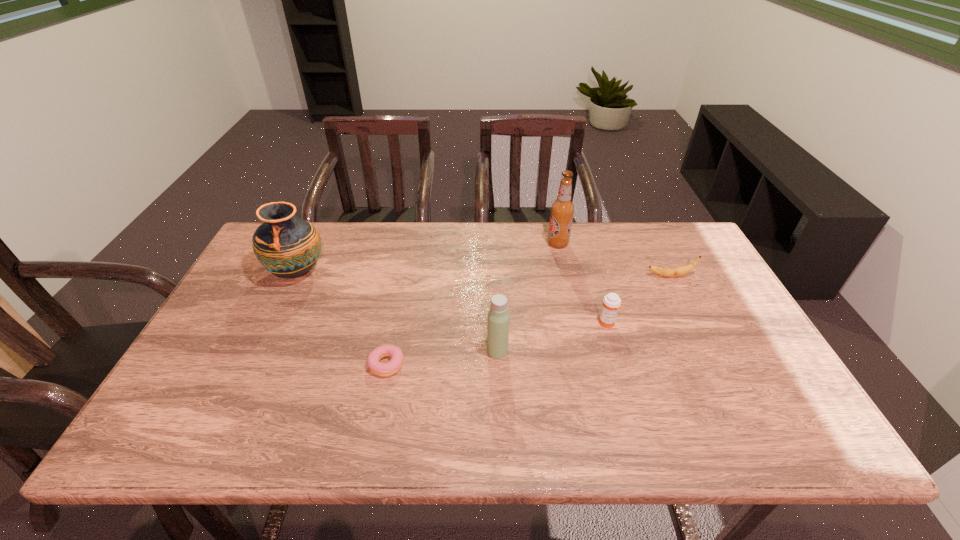
I want to click on free space at the far right corner of the desktop, so click(x=651, y=231).

This screenshot has width=960, height=540. Identify the location of vacant area between the banana and the beer bottle. (613, 260).

Locate an element on the screen. This screenshot has width=960, height=540. free spot between the leftmost object and the rightmost object is located at coordinates (x=483, y=274).

Find the location of `empty space between the farthest object and the pottery`. empty space between the farthest object and the pottery is located at coordinates (427, 258).

The image size is (960, 540). I want to click on unoccupied area between the third shortest object and the leftmost object, so click(452, 298).

Where is `unoccupied area between the beer bottle and the leftmost object`? The image size is (960, 540). unoccupied area between the beer bottle and the leftmost object is located at coordinates (427, 258).

This screenshot has width=960, height=540. In order to click on vacant space that's between the fifth object from left to right and the rightmost object in this screenshot , I will do `click(638, 300)`.

Find the location of a particular element. The width and height of the screenshot is (960, 540). free space between the thermos bottle and the banana is located at coordinates (584, 313).

Find the location of a particular element. free spot between the medicine and the pottery is located at coordinates (452, 298).

This screenshot has height=540, width=960. In order to click on empty space between the pottery and the medicine in this screenshot , I will do `click(452, 298)`.